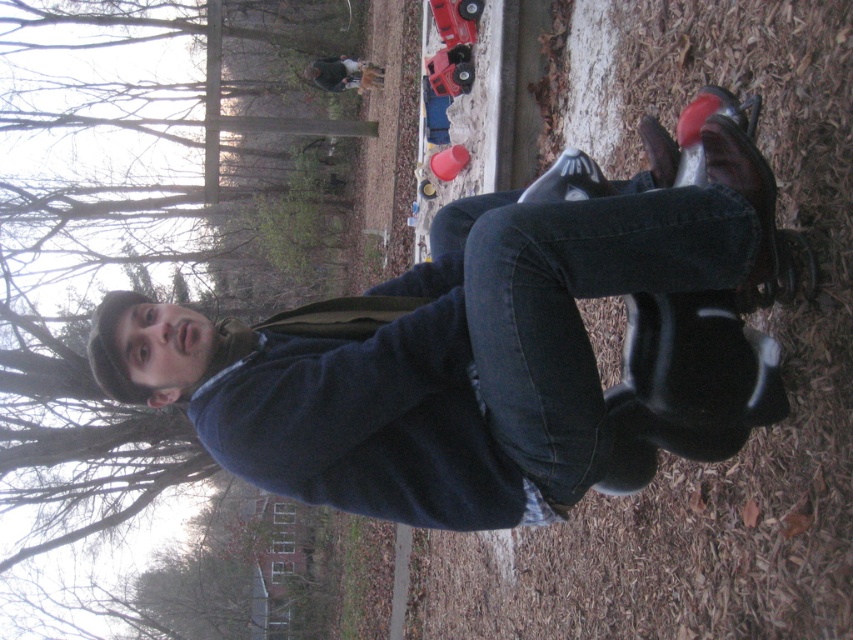
Which is more to the left, matte black skateboard at center or black leather shoe at lower right?

Positioned to the left is matte black skateboard at center.

Find the location of a particular element. matte black skateboard at center is located at coordinates (334, 400).

Is black rubber shoe at lower center wider than black leather shoe at lower right?

Yes.

Is black rubber shoe at lower center positioned in front of black leather shoe at lower right?

No.

Describe the element at coordinates (698, 362) in the screenshot. Image resolution: width=853 pixels, height=640 pixels. I see `black rubber shoe at lower center` at that location.

I want to click on black rubber shoe at lower center, so click(698, 362).

Can you confirm if denim at center is positioned to the right of matte black shoe at center?

Incorrect, denim at center is not on the right side of matte black shoe at center.

The image size is (853, 640). Describe the element at coordinates (573, 304) in the screenshot. I see `denim at center` at that location.

The image size is (853, 640). In order to click on denim at center in this screenshot , I will do `click(573, 304)`.

Where is `denim at center`? The width and height of the screenshot is (853, 640). denim at center is located at coordinates (573, 304).